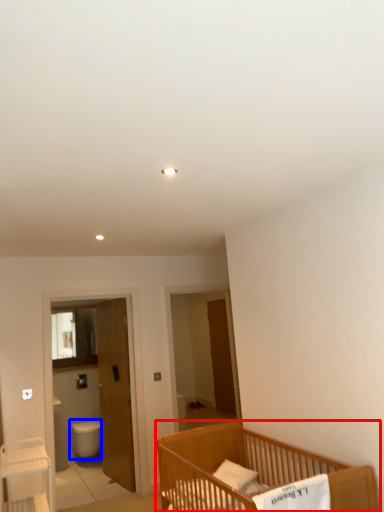
Question: Which of the following is the farthest to the observer, infant bed (highlighted by a red box) or toilet bowl (highlighted by a blue box)?

Choices:
 (A) infant bed
 (B) toilet bowl

Answer: (B)